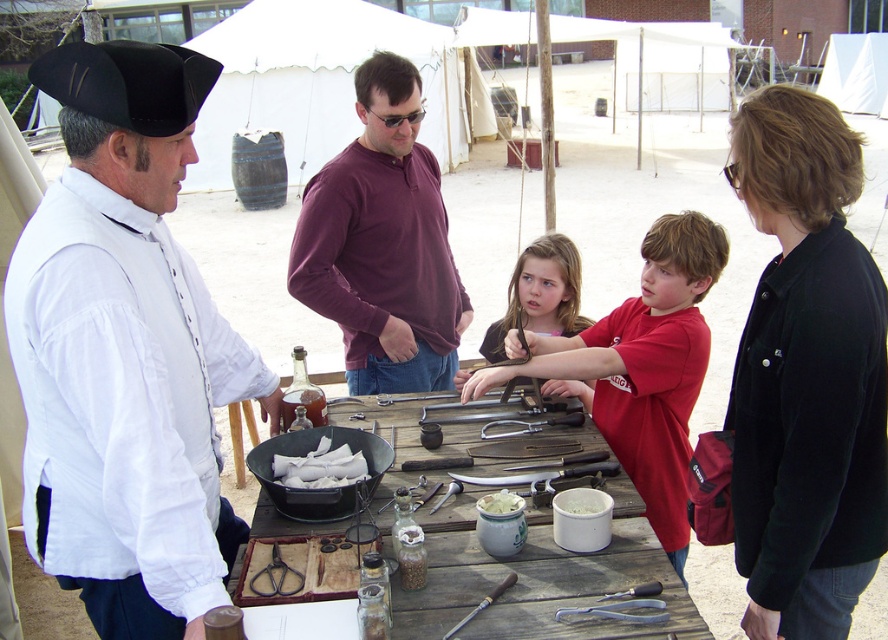
You are a photographer positioned behind the wooden table and want to capture both the white cotton shirt at left and the red cotton shirt at center in the same frame. Which shirt should you adjust to ensure both are fully visible?

Since the white cotton shirt at left is in front of the red cotton shirt at center, you should move the white cotton shirt at left slightly backward to allow the red cotton shirt at center to be fully visible in the frame.

You are organizing a historical reenactment event and need to arrange participants in order from left to right based on their clothing. Given the white cotton shirt at left and the red cotton shirt at center, which shirt should be placed first when arranging from left to right?

The white cotton shirt at left should be placed first when arranging from left to right because it is positioned on the left side of the red cotton shirt at center.

You are standing in front of the wooden table at the outdoor gathering. There are two points marked on the table surface. The first point is at coordinates point (152,284) and the second point is at point (679,273). Which point is closer to you?

Point (152,284) is closer to the viewer than point (679,273).